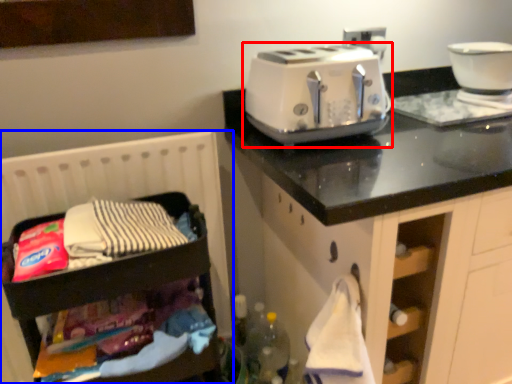
Question: Which of the following is the farthest to the observer, toaster (highlighted by a red box) or infant bed (highlighted by a blue box)?

Choices:
 (A) toaster
 (B) infant bed

Answer: (A)